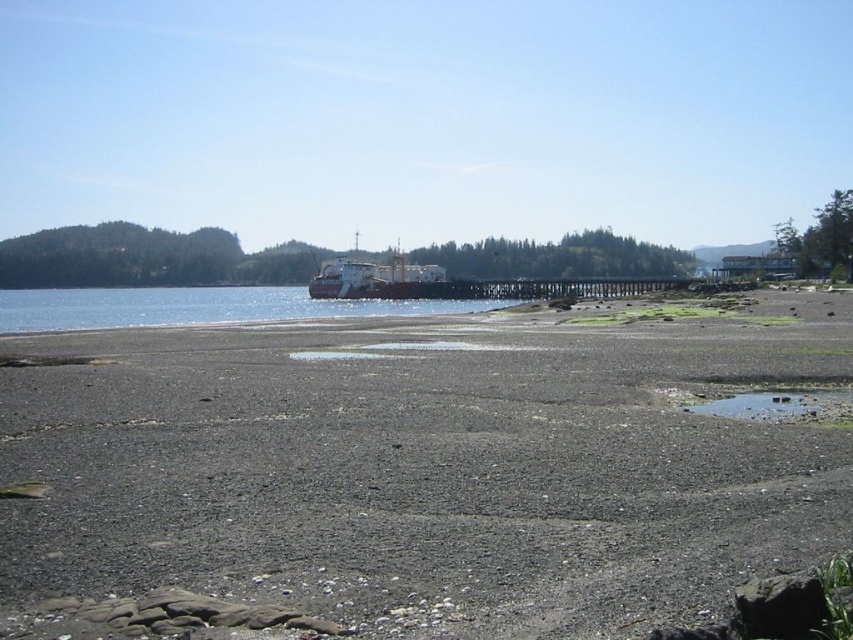
Can you confirm if clear water at center is bigger than white matte cargo ship at center?

Yes, clear water at center is bigger than white matte cargo ship at center.

Where is `clear water at center`? Image resolution: width=853 pixels, height=640 pixels. clear water at center is located at coordinates (199, 307).

Where is `clear water at center`? clear water at center is located at coordinates (199, 307).

Does gray gravelly sand at center appear under white matte cargo ship at center?

Yes, gray gravelly sand at center is below white matte cargo ship at center.

Between gray gravelly sand at center and white matte cargo ship at center, which one is positioned lower?

gray gravelly sand at center is lower down.

This screenshot has width=853, height=640. What do you see at coordinates (426, 467) in the screenshot?
I see `gray gravelly sand at center` at bounding box center [426, 467].

Identify the location of gray gravelly sand at center. (426, 467).

Is gray gravelly sand at center shorter than clear water at center?

Yes, gray gravelly sand at center is shorter than clear water at center.

Does point (509, 529) come farther from viewer compared to point (47, 308)?

No, (509, 529) is in front of (47, 308).

This screenshot has height=640, width=853. I want to click on gray gravelly sand at center, so 426,467.